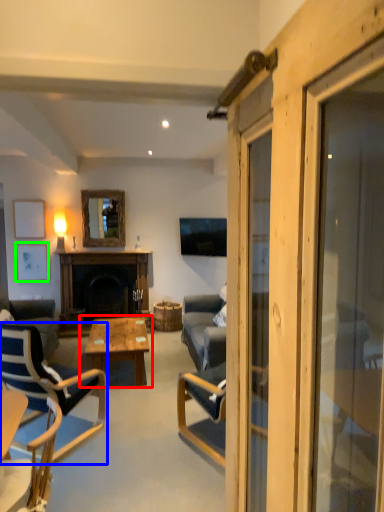
Question: Which is nearer to the coffee table (highlighted by a red box)? chair (highlighted by a blue box) or picture frame (highlighted by a green box).

Choices:
 (A) chair
 (B) picture frame

Answer: (A)